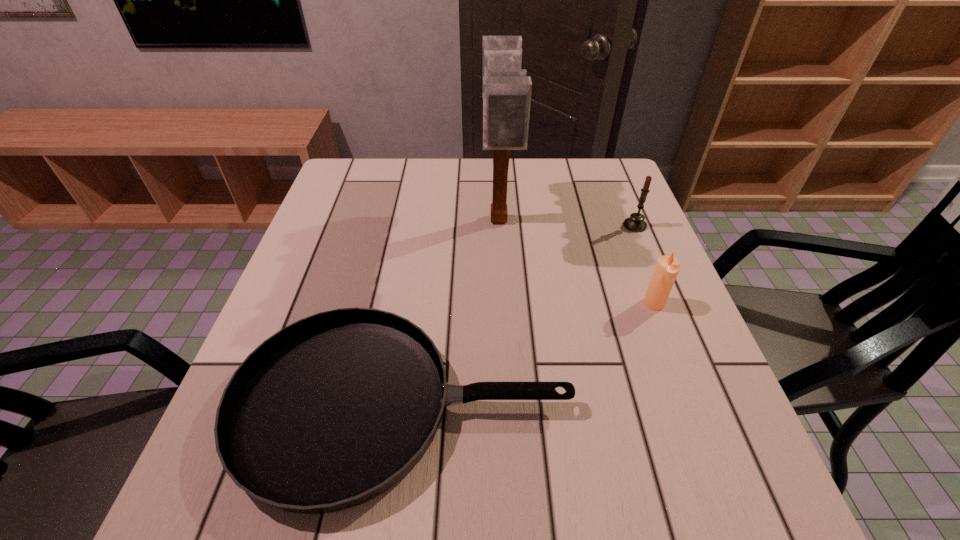
This screenshot has width=960, height=540. Identify the location of object that is at the near edge. (333, 410).

Identify the location of object that is positioned at the left edge. (333, 410).

You are a GUI agent. You are given a task and a screenshot of the screen. Output one action in this format:
    pyautogui.click(x=<x>, y=<y>)
    Task: Click on the object located in the near left corner section of the desktop
    The width and height of the screenshot is (960, 540).
    Given the screenshot: What is the action you would take?
    pyautogui.click(x=333, y=410)

This screenshot has width=960, height=540. In the image, there is a desktop. In order to click on vacant area at the far edge in this screenshot , I will do `click(431, 187)`.

Where is `blank space at the near edge of the desktop`? The image size is (960, 540). blank space at the near edge of the desktop is located at coordinates (384, 519).

Identify the location of vacant space at the left edge. This screenshot has width=960, height=540. (300, 266).

This screenshot has width=960, height=540. I want to click on vacant space at the right edge, so click(x=662, y=433).

The image size is (960, 540). Identify the location of vacant space at the far left corner of the desktop. (388, 162).

This screenshot has height=540, width=960. In order to click on vacant position at the near left corner of the desktop in this screenshot , I will do `click(232, 491)`.

I want to click on vacant space at the far right corner of the desktop, so click(x=581, y=170).